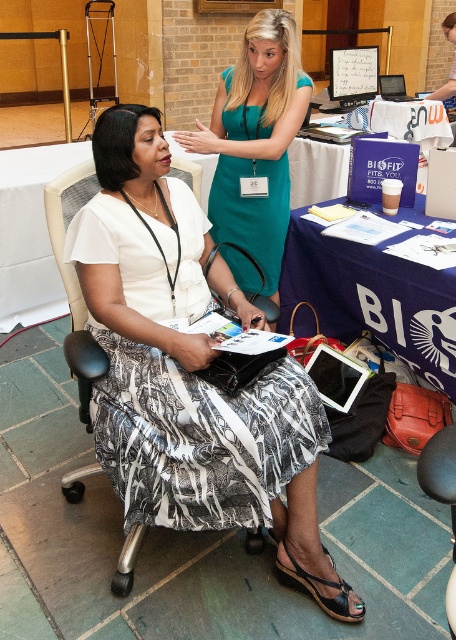
You are a photographer at the event and need to capture a photo of the teal satin dress at upper center and the black fabric chair at left. The camera you are using has a minimum focus distance of 32 inches. Will you be able to take a clear photo without moving either object?

The distance between the teal satin dress at upper center and the black fabric chair at left is 31.69 inches, which is slightly less than the camera minimum focus distance of 32 inches. Therefore, you will not be able to take a clear photo without moving either object closer to meet the focus requirement.

You are at a networking event and need to hand out brochures. You see a white matte tablet at center and a black fabric chair at left. Which object is positioned to the right of the other?

The white matte tablet at center is positioned to the right of the black fabric chair at left.

You are organizing a presentation and need to place the white matte tablet at center on the table where the black fabric chair at left is located. Considering their sizes, will the tablet fit on the table without overhanging the edges?

The white matte tablet at center is wider than the black fabric chair at left, so it might not fit on the table if the table is the same size as the chair. However, since the chair and tablet are separate objects, their dimensions don